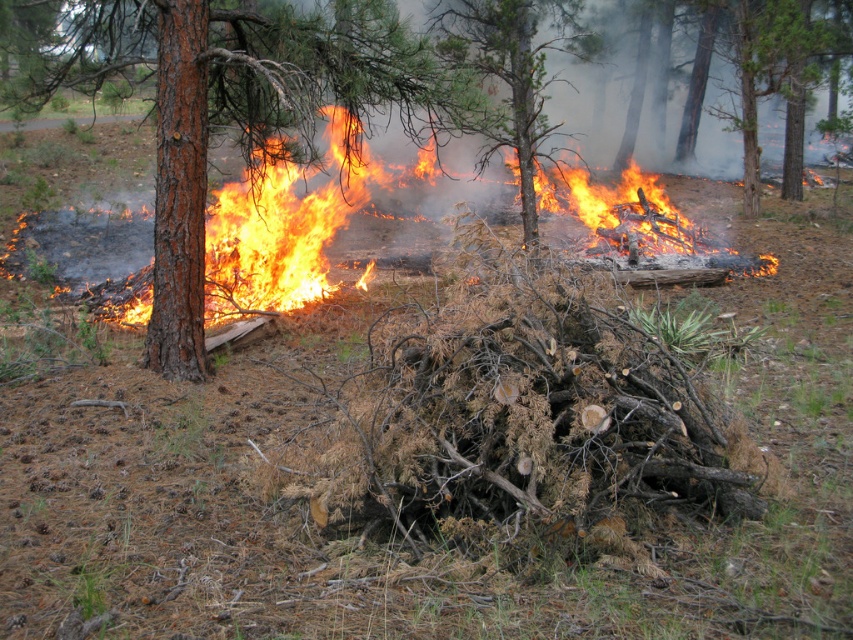
Looking at this image, does brown rough bark tree at left have a greater width compared to charred wood tree at center?

Yes, brown rough bark tree at left is wider than charred wood tree at center.

Which is more to the left, brown rough bark tree at left or charred wood tree at center?

brown rough bark tree at left is more to the left.

Between point (160, 180) and point (495, 129), which one is positioned behind?

Positioned behind is point (495, 129).

Identify the location of brown rough bark tree at left. This screenshot has height=640, width=853. (233, 102).

Which is more to the left, flaming wood at center or charred wood tree at center?

flaming wood at center

Which is below, flaming wood at center or charred wood tree at center?

flaming wood at center is lower down.

Identify the location of flaming wood at center. (280, 236).

Based on the photo, is brown rough bark tree at left to the right of flaming wood at center from the viewer's perspective?

No, brown rough bark tree at left is not to the right of flaming wood at center.

Is point (140, 19) in front of point (642, 179)?

Yes, it is in front of point (642, 179).

At what (x,y) coordinates should I click in order to perform the action: click on brown rough bark tree at left. Please return your answer as a coordinate pair (x, y). Looking at the image, I should click on (233, 102).